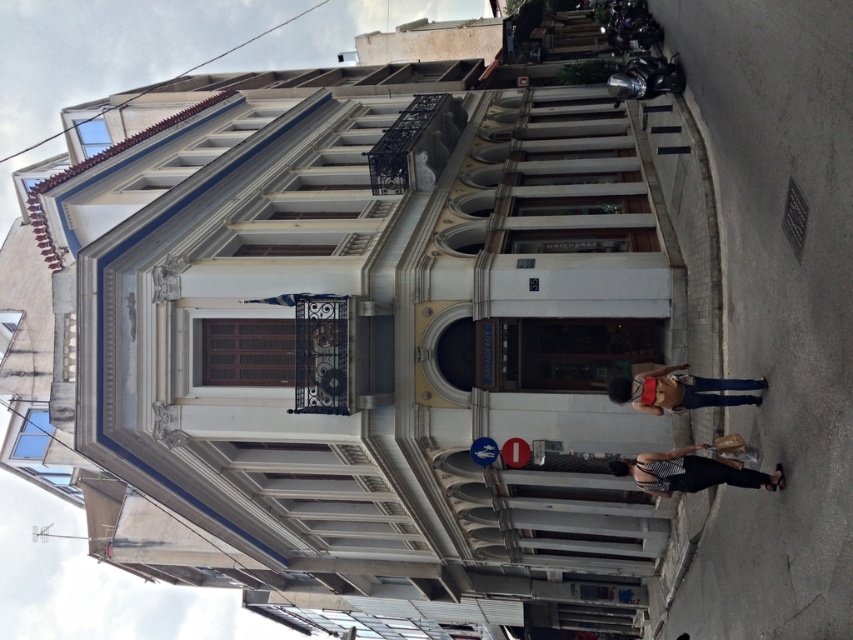
You are a customer in a clothing store and see a striped fabric dress at lower center and denim jeans at lower right. Which item is positioned closer to the floor?

The striped fabric dress at lower center is located below denim jeans at lower right, so it is closer to the floor.

You are a customer standing in front of the building and see the striped fabric dress at lower center and the denim jeans at lower right displayed outside. If you want to pick up both items, will you need to walk more than 10 feet to collect them?

The striped fabric dress at lower center and denim jeans at lower right are 9.59 feet apart from each other, so you will not need to walk more than 10 feet to collect them.

You are a customer in a clothing store and see the striped fabric dress at lower center and the denim jeans at lower right. Which item is closer to you?

The striped fabric dress at lower center is closer to you because it is in front of the denim jeans at lower right.